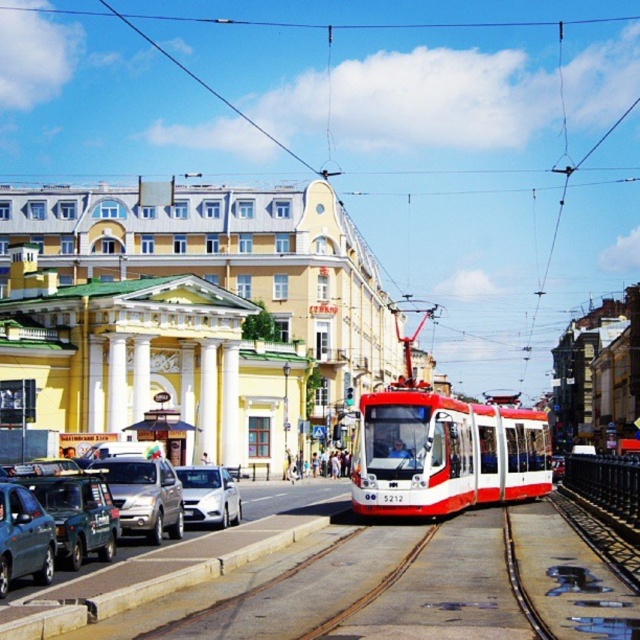
From the picture: You are standing at the tram tracks and want to determine the relative positions of two points marked in the scene. Which point is closer to you, point (64,532) or point (4,518)?

Point (64,532) is further to the viewer than point (4,518). Therefore, point (4,518) is closer to you.